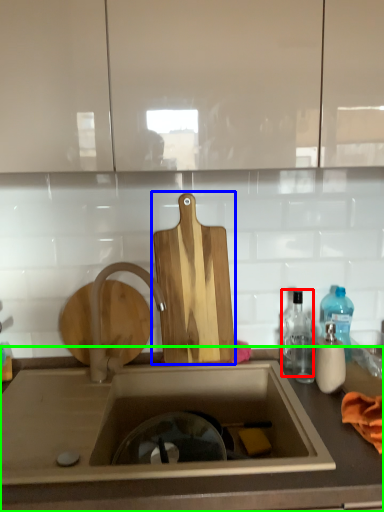
Question: Based on their relative distances, which object is nearer to bottle (highlighted by a red box)? Choose from cutting board (highlighted by a blue box) and countertop (highlighted by a green box).

Choices:
 (A) cutting board
 (B) countertop

Answer: (A)